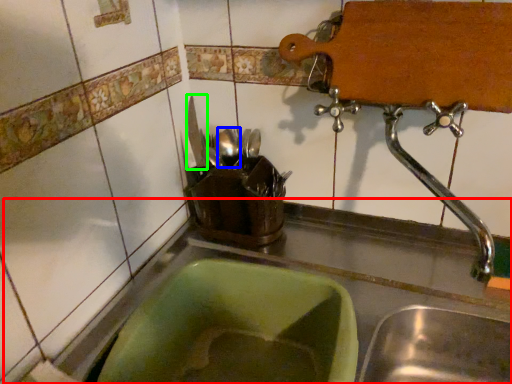
Question: Which is farther away from counter top (highlighted by a red box)? tableware (highlighted by a blue box) or tableware (highlighted by a green box)?

Choices:
 (A) tableware
 (B) tableware

Answer: (B)